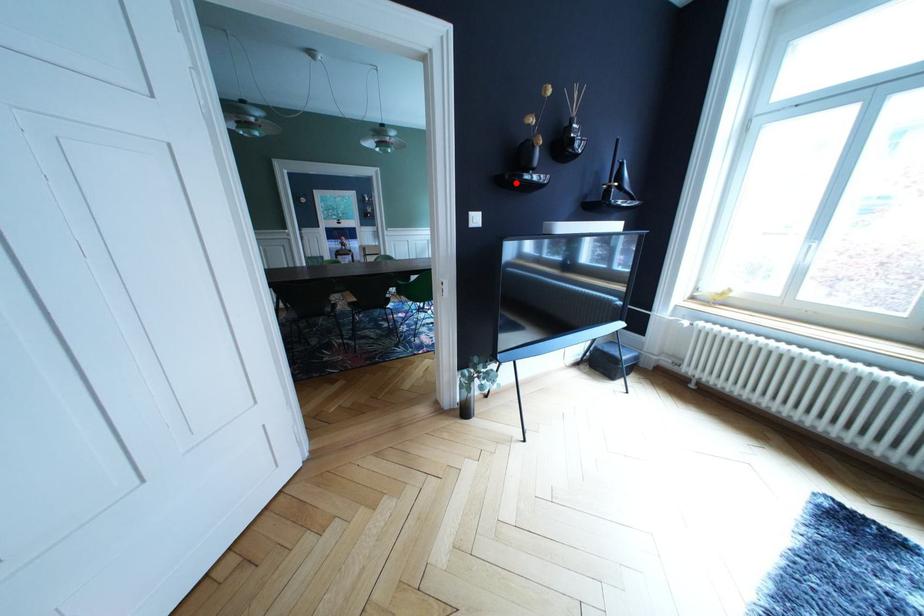
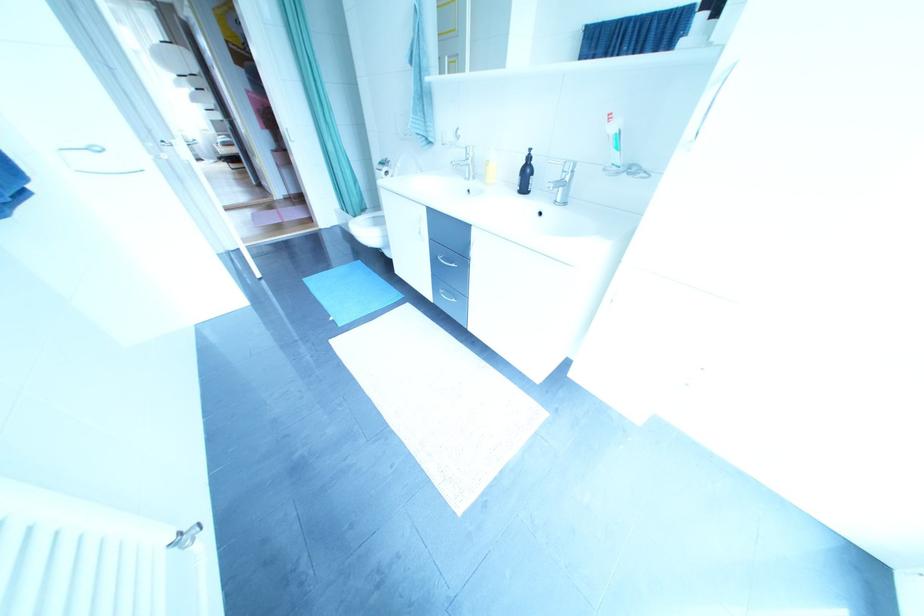
Question: I am providing you with two images of the same scene from different viewpoints. A red point is marked on the first image. At the location where the point appears in image 1, is it still visible in image 2?

Choices:
 (A) Yes
 (B) No

Answer: (B)